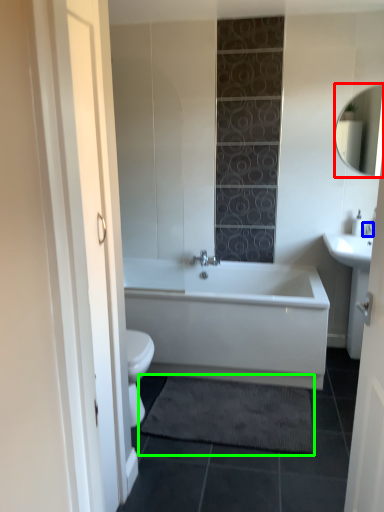
Question: Which is farther away from mirror (highlighted by a red box)? faucet (highlighted by a blue box) or bath mat (highlighted by a green box)?

Choices:
 (A) faucet
 (B) bath mat

Answer: (B)